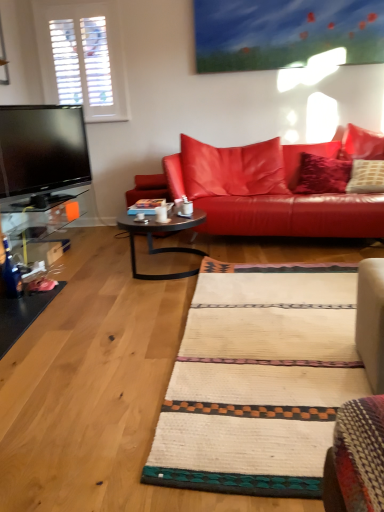
Question: From a real-world perspective, is white glossy mug at center positioned under leather couch at center based on gravity?

Choices:
 (A) no
 (B) yes

Answer: (B)

Question: Considering the relative sizes of white glossy mug at center and leather couch at center in the image provided, is white glossy mug at center thinner than leather couch at center?

Choices:
 (A) no
 (B) yes

Answer: (B)

Question: Does white glossy mug at center have a lesser height compared to leather couch at center?

Choices:
 (A) no
 (B) yes

Answer: (B)

Question: Is white glossy mug at center to the right of leather couch at center from the viewer's perspective?

Choices:
 (A) yes
 (B) no

Answer: (B)

Question: Is leather couch at center at the back of white glossy mug at center?

Choices:
 (A) yes
 (B) no

Answer: (B)

Question: From a real-world perspective, is white glossy mug at center on leather couch at center?

Choices:
 (A) yes
 (B) no

Answer: (B)

Question: From a real-world perspective, is leather couch at center on white glossy mug at center?

Choices:
 (A) yes
 (B) no

Answer: (A)

Question: Does leather couch at center touch white glossy mug at center?

Choices:
 (A) no
 (B) yes

Answer: (A)

Question: Is leather couch at center not close to white glossy mug at center?

Choices:
 (A) no
 (B) yes

Answer: (A)

Question: Is leather couch at center thinner than white glossy mug at center?

Choices:
 (A) no
 (B) yes

Answer: (A)

Question: Is leather couch at center facing away from white glossy mug at center?

Choices:
 (A) no
 (B) yes

Answer: (A)

Question: From the image's perspective, is leather couch at center on white glossy mug at center?

Choices:
 (A) no
 (B) yes

Answer: (B)

Question: From a real-world perspective, is white glossy mug at center located higher than metallic black coffee table at center?

Choices:
 (A) yes
 (B) no

Answer: (A)